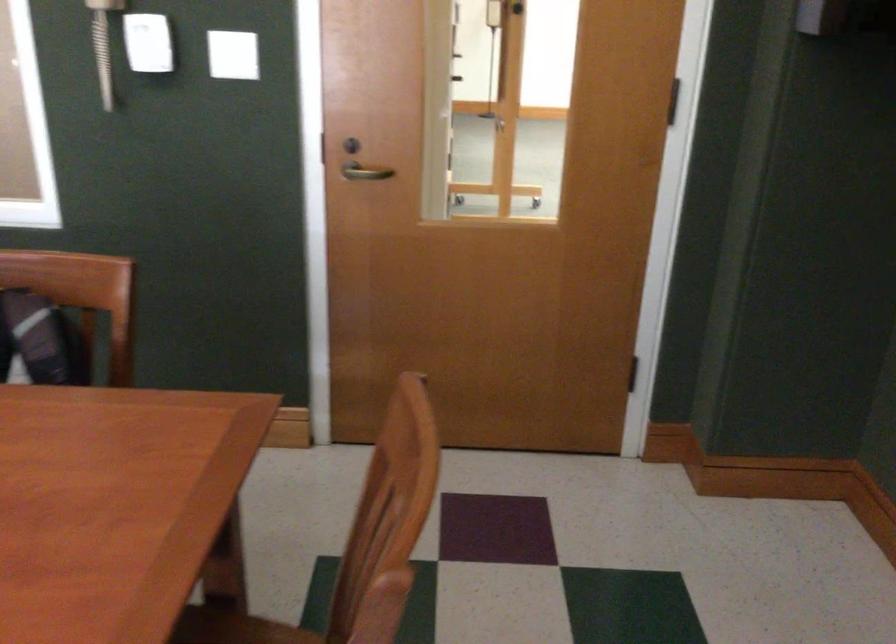
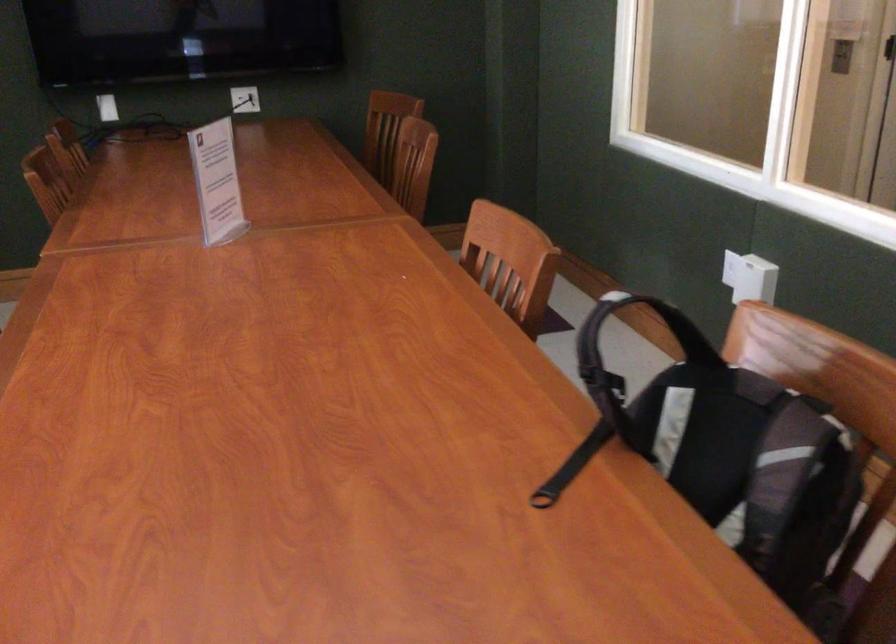
Question: The camera is either moving clockwise (left) or counter-clockwise (right) around the object. The first image is from the beginning of the video and the second image is from the end. Is the camera moving left or right when shooting the video?

Choices:
 (A) Left
 (B) Right

Answer: (B)